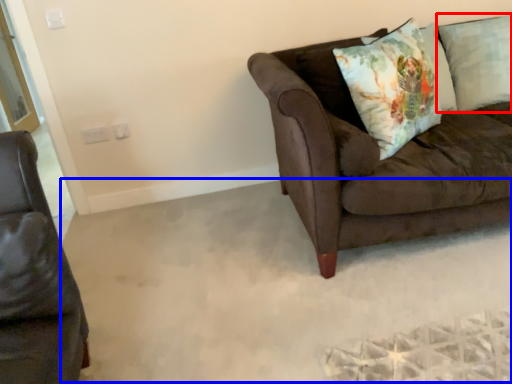
Question: Which object is closer to the camera taking this photo, pillow (highlighted by a red box) or plain (highlighted by a blue box)?

Choices:
 (A) pillow
 (B) plain

Answer: (B)